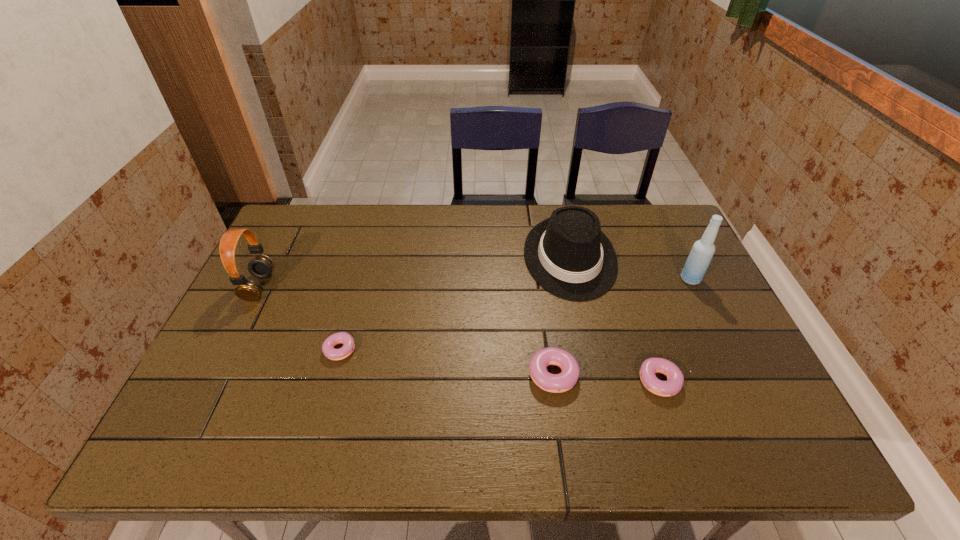
Please point a location where one more doughnut can be added evenly. Please provide its 2D coordinates. Your answer should be formatted as a tuple, i.e. [(x, y)], where the tuple contains the x and y coordinates of a point satisfying the conditions above.

[(445, 360)]